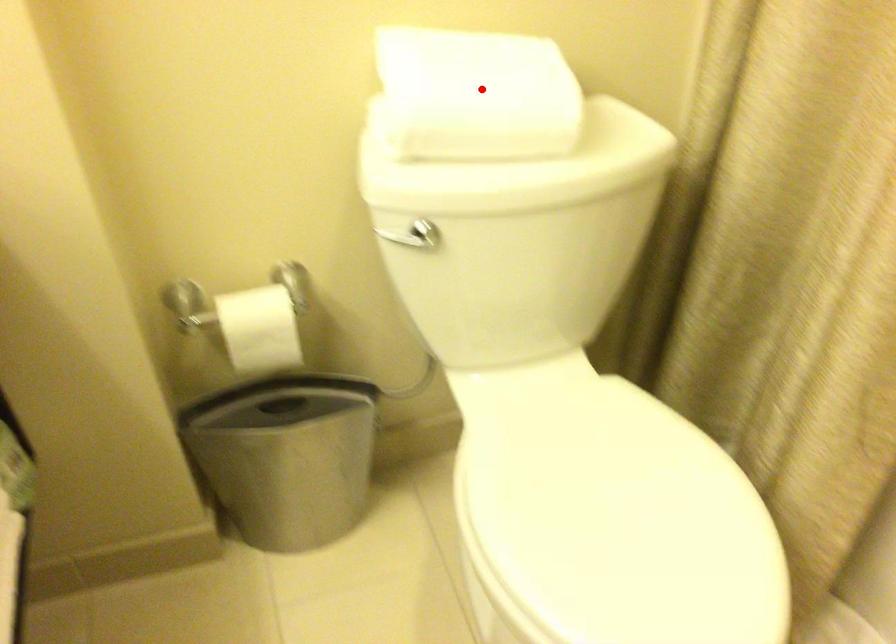
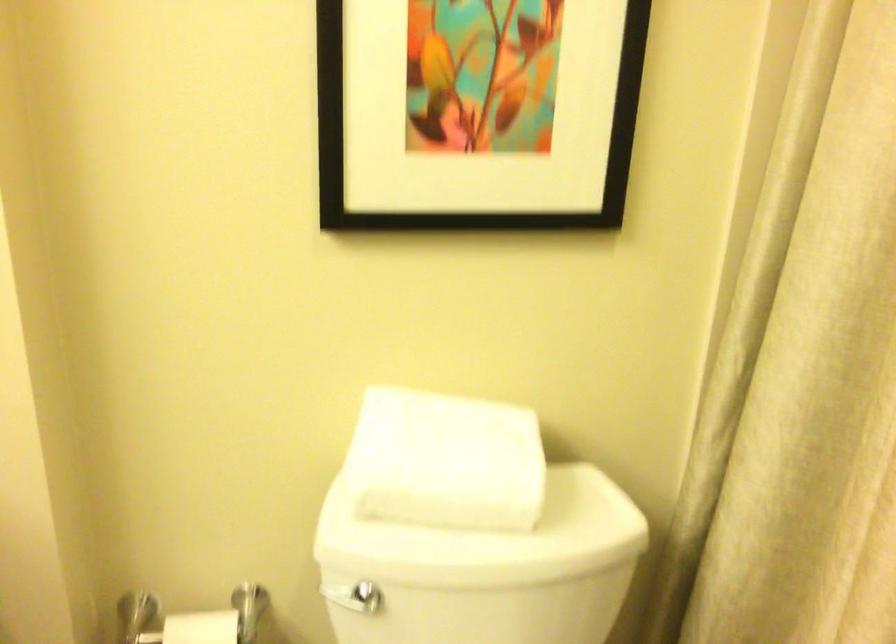
The point at the highlighted location is marked in the first image. Where is the corresponding point in the second image?

(445, 460)